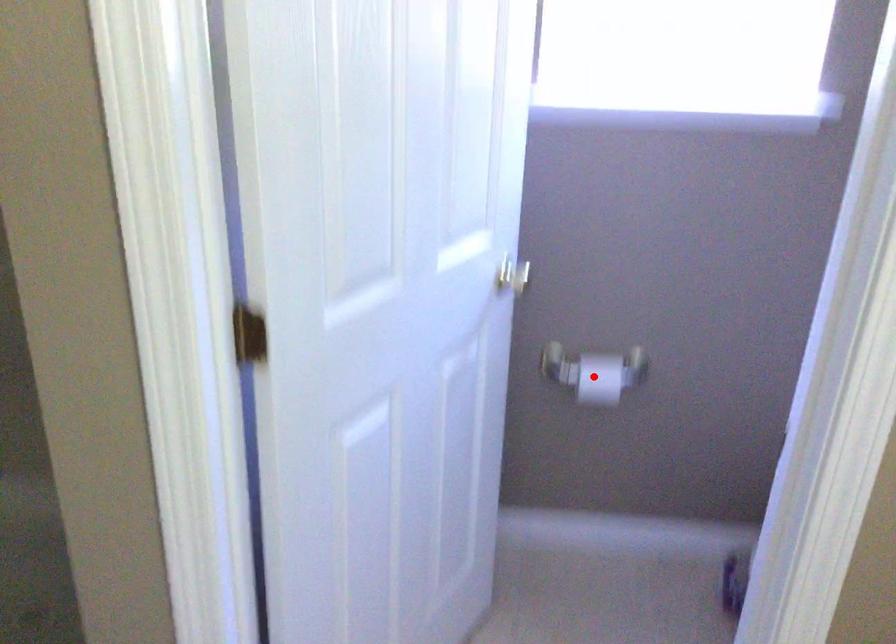
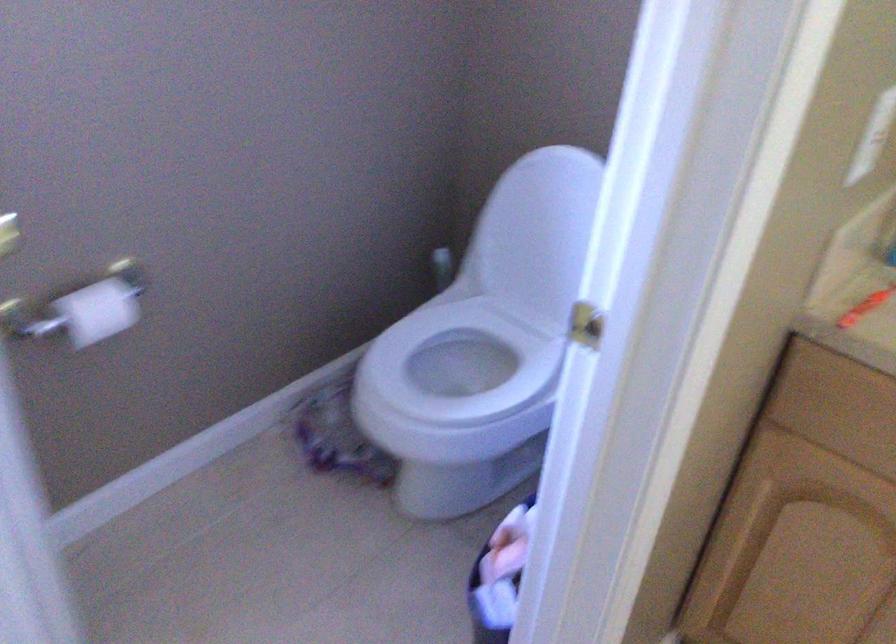
Question: A red point is marked in image1. In image2, is the corresponding 3D point closer to the camera or farther? Reply with the corresponding letter.

Choices:
 (A) The corresponding 3D point is closer.
 (B) The corresponding 3D point is farther.

Answer: (A)